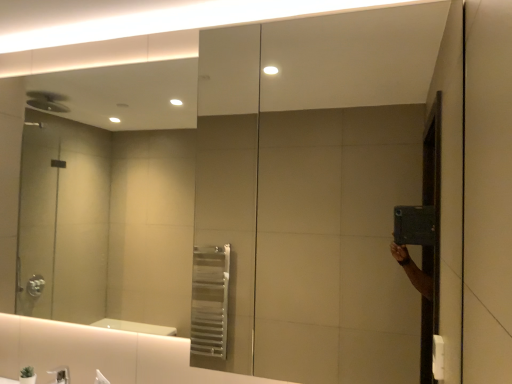
Locate an element on the screen. matte silver mirror at upper left is located at coordinates (111, 196).

This screenshot has height=384, width=512. What do you see at coordinates (111, 196) in the screenshot? I see `matte silver mirror at upper left` at bounding box center [111, 196].

This screenshot has width=512, height=384. Find the location of `matte silver mirror at upper left`. matte silver mirror at upper left is located at coordinates (111, 196).